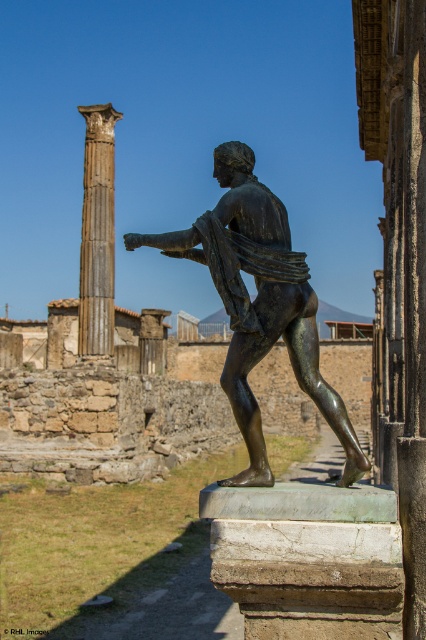
Is point (285, 240) farther from viewer compared to point (109, 340)?

No, (285, 240) is in front of (109, 340).

This screenshot has height=640, width=426. I want to click on bronze statue at center, so click(259, 304).

Find the location of a particular element. bronze statue at center is located at coordinates (259, 304).